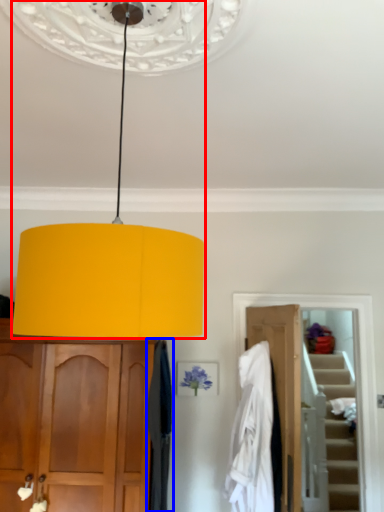
Question: Among these objects, which one is farthest to the camera, lamp (highlighted by a red box) or curtain (highlighted by a blue box)?

Choices:
 (A) lamp
 (B) curtain

Answer: (B)